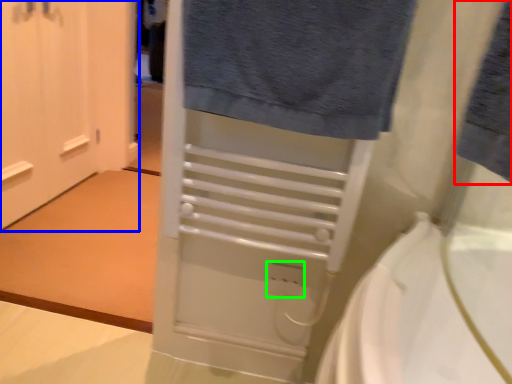
Question: Estimate the real-world distances between objects in this image. Which object is farther from bath towel (highlighted by a red box), door (highlighted by a blue box) or electric outlet (highlighted by a green box)?

Choices:
 (A) door
 (B) electric outlet

Answer: (A)